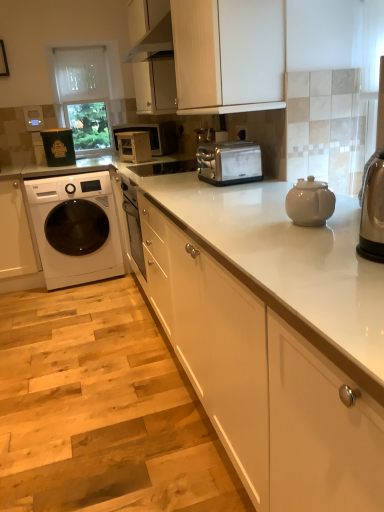
Question: Does white glossy washing machine at left appear on the left side of white glossy cabinet at left, positioned as the third cabinetry in right-to-left order?

Choices:
 (A) no
 (B) yes

Answer: (A)

Question: Is white glossy washing machine at left thinner than white glossy cabinet at left, positioned as the third cabinetry in right-to-left order?

Choices:
 (A) yes
 (B) no

Answer: (B)

Question: Is white glossy washing machine at left bigger than white glossy cabinet at left, positioned as the third cabinetry in right-to-left order?

Choices:
 (A) no
 (B) yes

Answer: (B)

Question: Is white glossy washing machine at left to the right of white glossy cabinet at left, marked as the first cabinetry in a left-to-right arrangement, from the viewer's perspective?

Choices:
 (A) yes
 (B) no

Answer: (A)

Question: From the image's perspective, is white glossy washing machine at left located above white glossy cabinet at left, marked as the first cabinetry in a left-to-right arrangement?

Choices:
 (A) yes
 (B) no

Answer: (A)

Question: Is white glossy washing machine at left not close to white glossy cabinet at left, positioned as the third cabinetry in right-to-left order?

Choices:
 (A) yes
 (B) no

Answer: (B)

Question: Is matte black container at left, which appears as the first appliance when viewed from the left, with matte white microwave at center?

Choices:
 (A) yes
 (B) no

Answer: (B)

Question: Considering the relative sizes of matte black container at left, the 2th appliance positioned from the right, and matte white microwave at center in the image provided, is matte black container at left, the 2th appliance positioned from the right, wider than matte white microwave at center?

Choices:
 (A) yes
 (B) no

Answer: (B)

Question: From the image's perspective, is matte black container at left, which appears as the first appliance when viewed from the left, beneath matte white microwave at center?

Choices:
 (A) yes
 (B) no

Answer: (A)

Question: Considering the relative positions of matte black container at left, which appears as the first appliance when viewed from the left, and matte white microwave at center in the image provided, is matte black container at left, which appears as the first appliance when viewed from the left, behind matte white microwave at center?

Choices:
 (A) yes
 (B) no

Answer: (B)

Question: Is matte black container at left, which appears as the first appliance when viewed from the left, positioned in front of matte white microwave at center?

Choices:
 (A) no
 (B) yes

Answer: (B)

Question: Considering the relative sizes of matte black container at left, which appears as the first appliance when viewed from the left, and matte white microwave at center in the image provided, is matte black container at left, which appears as the first appliance when viewed from the left, bigger than matte white microwave at center?

Choices:
 (A) yes
 (B) no

Answer: (B)

Question: Can you confirm if satin silver microwave at center, the 2th appliance in the left-to-right sequence, is shorter than transparent glass door at upper center, the 2th glass door when ordered from top to bottom?

Choices:
 (A) yes
 (B) no

Answer: (A)